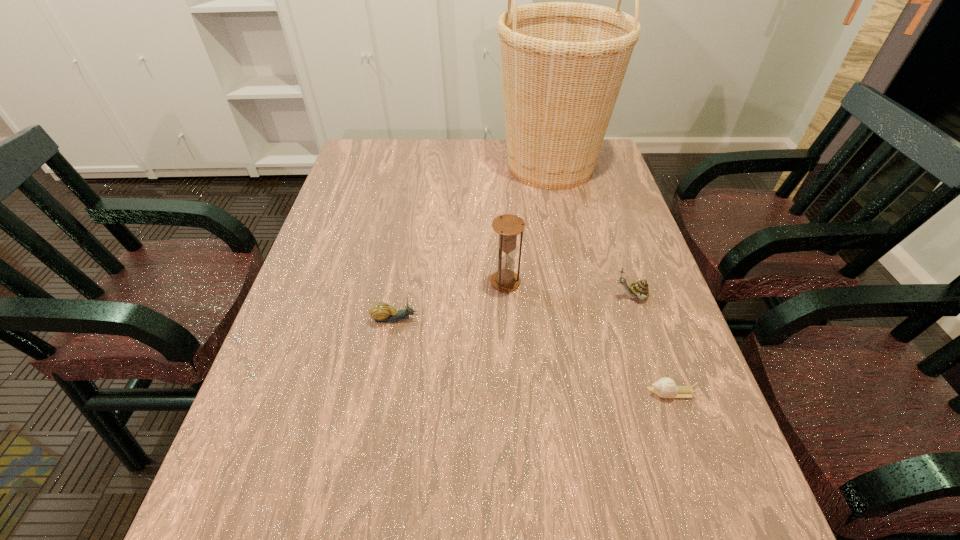
Identify the location of free spot that satisfies the following two spatial constraints: 1. on the front side of the second tallest object; 2. on the front-facing side of the leftmost escargot. The width and height of the screenshot is (960, 540). coord(508,319).